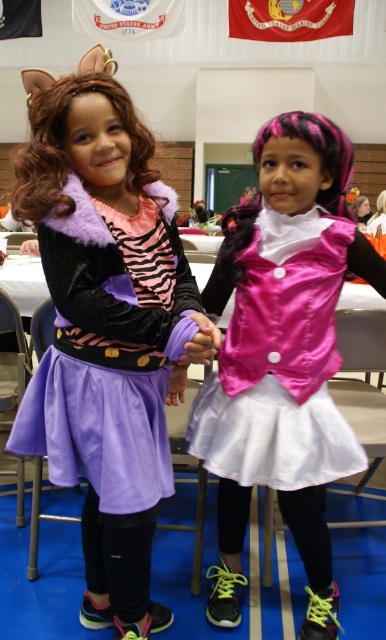
Is point (255, 157) in front of point (353, 317)?

Yes, point (255, 157) is closer to viewer.

Between pink satin vest at center and metallic silver chair at lower center, which one has more height?

pink satin vest at center

Who is more distant from viewer, (221, 605) or (347, 380)?

Positioned behind is point (347, 380).

Identify the location of pink satin vest at center. This screenshot has height=640, width=386. (282, 355).

What do you see at coordinates (106, 333) in the screenshot?
I see `purple velvet dress at center` at bounding box center [106, 333].

Is purple velvet dress at center further to the viewer compared to metallic silver chair at lower center?

No, it is in front of metallic silver chair at lower center.

Identify the location of purple velvet dress at center. The image size is (386, 640). (106, 333).

Is purple velvet dress at center smaller than pink satin vest at center?

Actually, purple velvet dress at center might be larger than pink satin vest at center.

Is point (125, 360) more distant than point (306, 621)?

No, (125, 360) is closer to viewer.

Where is `purple velvet dress at center`? The image size is (386, 640). purple velvet dress at center is located at coordinates (106, 333).